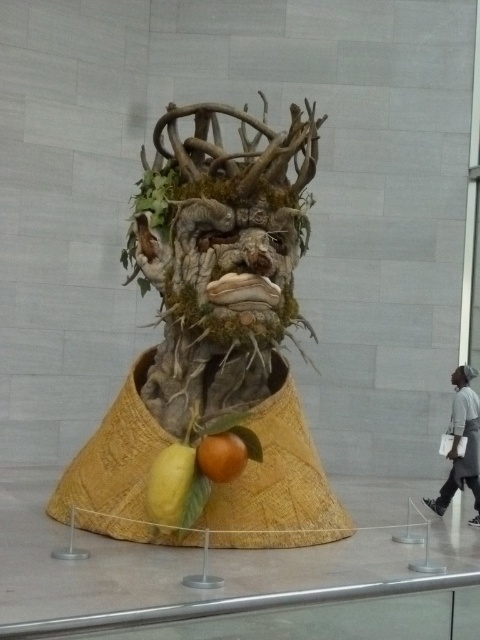
You are a visitor at the museum and see the sculpture. You notice the gray fabric jacket at lower right and the matte brown mask at center. Which object is closer to you?

The gray fabric jacket at lower right is closer to you because it is in front of the matte brown mask at center.

You are an art curator planning to install a new light fixture that needs to be placed either above the mossy bark mask at center or above the orange matte at lower center. Based on the sculpture layout, which object should the light be placed above to ensure it illuminates the mask properly?

The mossy bark mask at center is positioned over the orange matte at lower center, so placing the light above the mossy bark mask at center will ensure proper illumination of the mask.

You are an art curator planning to install a new lighting system for the sculpture. You have two lights available, one that can reach up to 1.5 meters and another that can reach up to 2 meters. The yellow matte pear at lower center and orange matte at lower center are both in need of illumination. Given their heights, which light should you use for each object to ensure proper coverage?

The yellow matte pear at lower center is much taller than the orange matte at lower center. Therefore, the 2 meter light should be used for the yellow matte pear at lower center and the 1.5 meter light for the orange matte at lower center to ensure proper coverage.